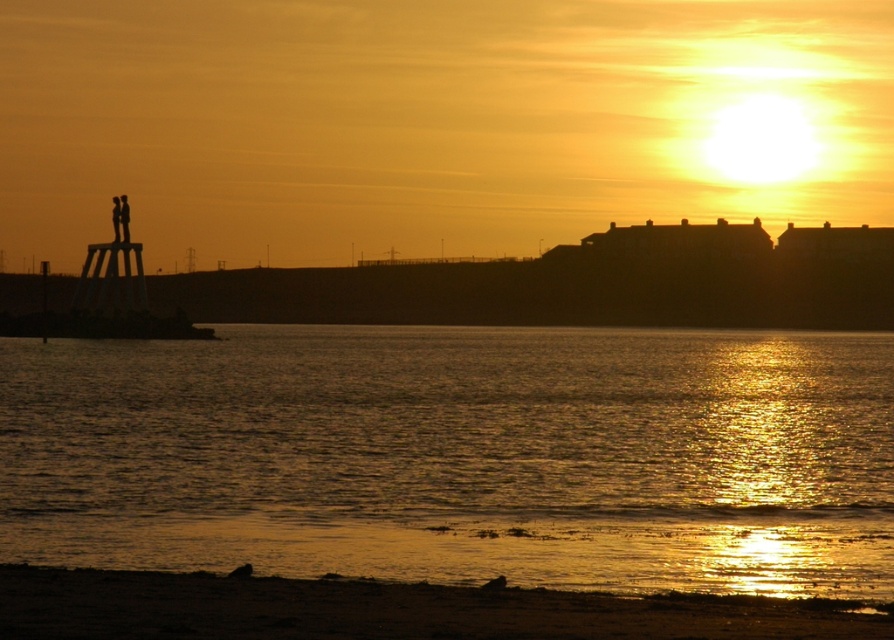
Is black silhouette at left to the right of silhouette figure at left from the viewer's perspective?

Correct, you'll find black silhouette at left to the right of silhouette figure at left.

Is black silhouette at left further to camera compared to silhouette figure at left?

No, black silhouette at left is in front of silhouette figure at left.

The image size is (894, 640). What are the coordinates of `black silhouette at left` in the screenshot? It's located at (124, 218).

Is golden reflective water at lower center below black silhouette at left?

Yes, golden reflective water at lower center is below black silhouette at left.

Is point (874, 449) more distant than point (125, 211)?

No, it is not.

Describe the element at coordinates (460, 456) in the screenshot. I see `golden reflective water at lower center` at that location.

In order to click on golden reflective water at lower center in this screenshot , I will do `click(460, 456)`.

Based on the photo, who is shorter, golden reflective water at lower center or sandy brown beach at lower center?

With less height is sandy brown beach at lower center.

Which is above, golden reflective water at lower center or sandy brown beach at lower center?

sandy brown beach at lower center is higher up.

Is point (645, 400) positioned after point (642, 616)?

Yes, it is.

Identify the location of golden reflective water at lower center. (460, 456).